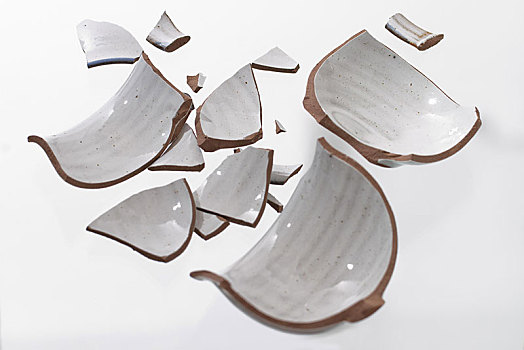
Identify the location of farest right piece of broken dish. (475, 119).